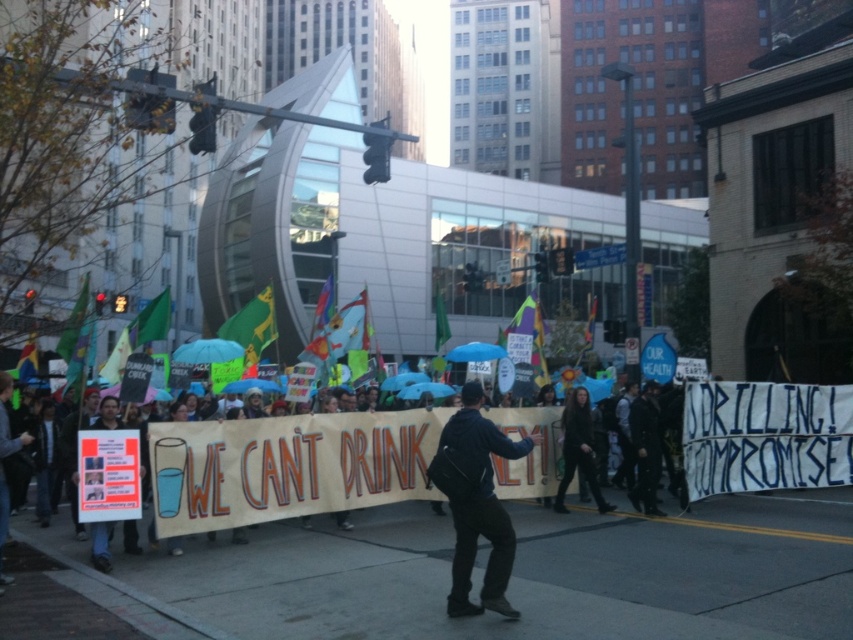
Question: From the image, what is the correct spatial relationship of dark blue jacket at center in relation to black leather jacket at center?

Choices:
 (A) left
 (B) right

Answer: (A)

Question: Which object appears farthest from the camera in this image?

Choices:
 (A) brown cardboard banner at center
 (B) black leather jacket at center

Answer: (B)

Question: Is brown cardboard banner at center further to the viewer compared to black leather jacket at center?

Choices:
 (A) yes
 (B) no

Answer: (B)

Question: Which of the following is the closest to the observer?

Choices:
 (A) brown cardboard banner at center
 (B) dark blue jacket at center

Answer: (B)

Question: Can you confirm if dark blue jacket at center is positioned to the right of black leather jacket at center?

Choices:
 (A) yes
 (B) no

Answer: (B)

Question: Which point appears farthest from the camera in this image?

Choices:
 (A) (496, 518)
 (B) (583, 433)

Answer: (B)